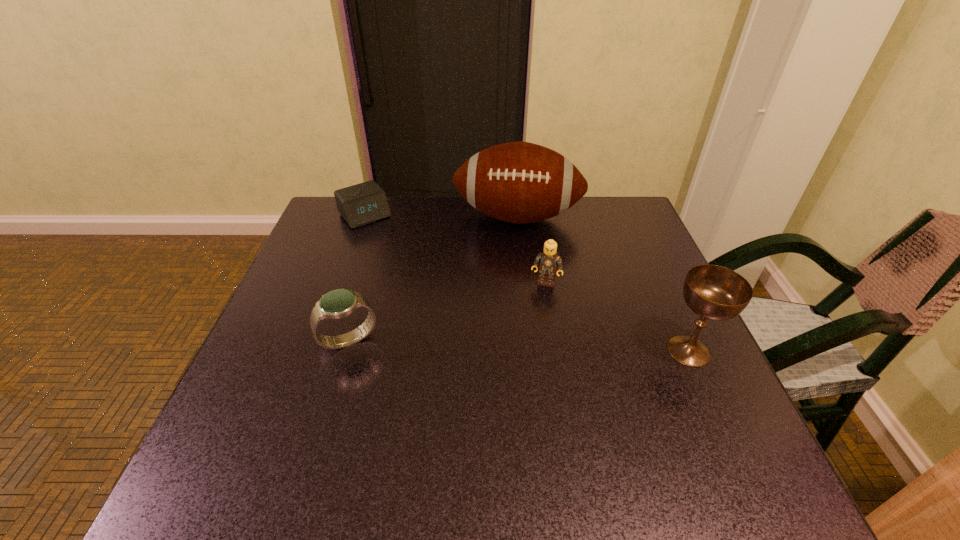
You are a GUI agent. You are given a task and a screenshot of the screen. Output one action in this format:
    pyautogui.click(x=<x>, y=<y>)
    Task: Click on the alarm clock present at the left edge
    
    Given the screenshot: What is the action you would take?
    pyautogui.click(x=364, y=203)

Where is `object located at the right edge`? This screenshot has height=540, width=960. object located at the right edge is located at coordinates (713, 292).

Find the location of a particular element. This screenshot has height=540, width=960. object present at the far left corner is located at coordinates (364, 203).

The image size is (960, 540). In the image, there is a desktop. In order to click on free space at the far edge in this screenshot , I will do `click(521, 229)`.

Find the location of `free space at the near edge of the desktop`. free space at the near edge of the desktop is located at coordinates (482, 407).

This screenshot has width=960, height=540. In the image, there is a desktop. In order to click on vacant space at the left edge in this screenshot , I will do `click(299, 375)`.

The image size is (960, 540). Find the location of `blank space at the right edge`. blank space at the right edge is located at coordinates (670, 313).

The image size is (960, 540). In the image, there is a desktop. Find the location of `vacant space at the far right corner`. vacant space at the far right corner is located at coordinates (630, 210).

Locate an element on the screen. The width and height of the screenshot is (960, 540). free region at the near right corner is located at coordinates (664, 397).

Where is `free space that is in between the chalice and the alarm clock`? free space that is in between the chalice and the alarm clock is located at coordinates click(527, 283).